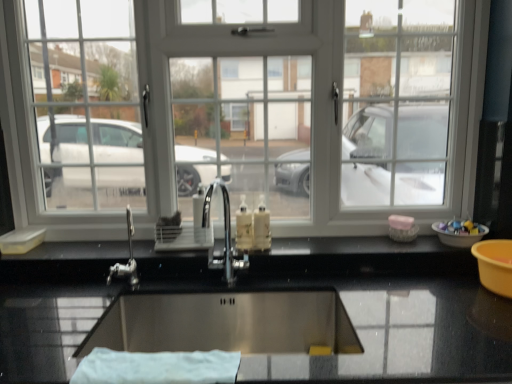
Identify the location of white cloth at lower center. click(x=157, y=367).

What do you see at coordinates (244, 110) in the screenshot? I see `white plastic window at center` at bounding box center [244, 110].

Find the location of a particular element. stainless steel sink at center is located at coordinates (226, 322).

Locate an element on the screen. The height and width of the screenshot is (384, 512). polished chrome tap at center is located at coordinates pyautogui.click(x=225, y=236).

Where is `white cloth at lower center`? Image resolution: width=512 pixels, height=384 pixels. white cloth at lower center is located at coordinates (157, 367).

Does polished chrome tap at center have a greater height compared to stainless steel sink at center?

Correct, polished chrome tap at center is much taller as stainless steel sink at center.

Is polished chrome tap at center inside or outside of stainless steel sink at center?

polished chrome tap at center lies outside stainless steel sink at center.

Is point (229, 250) less distant than point (346, 326)?

No, (229, 250) is further to viewer.

Considering the positions of objects polished chrome tap at center and stainless steel sink at center in the image provided, who is behind, polished chrome tap at center or stainless steel sink at center?

polished chrome tap at center is behind.

From a real-world perspective, who is located lower, white plastic window at center or translucent plastic soap dispenser at center?

translucent plastic soap dispenser at center.

In the image, there is a white plastic window at center. At what (x,y) coordinates should I click in order to perform the action: click on soap dispenser below it (from a real-world perspective). Please return your answer as a coordinate pair (x, y). Looking at the image, I should click on (244, 227).

Which object is further away from the camera taking this photo, white plastic window at center or translucent plastic soap dispenser at center?

white plastic window at center is further from the camera.

You are a GUI agent. You are given a task and a screenshot of the screen. Output one action in this format:
    pyautogui.click(x=<x>, y=<y>)
    Task: Click on the bath towel that appears in front of the white plastic bowl at right
    
    Given the screenshot: What is the action you would take?
    pyautogui.click(x=157, y=367)

Is white plastic bowl at right thinner than white cloth at lower center?

In fact, white plastic bowl at right might be wider than white cloth at lower center.

From a real-world perspective, is white plastic bowl at right beneath white cloth at lower center?

Incorrect, from a real-world perspective, white plastic bowl at right is higher than white cloth at lower center.

Considering the relative sizes of polished chrome tap at center and white plastic bowl at right in the image provided, is polished chrome tap at center bigger than white plastic bowl at right?

Yes, polished chrome tap at center is bigger than white plastic bowl at right.

In the image, there is a white plastic bowl at right. Where is `tap below it (from the image's perspective)`? The image size is (512, 384). tap below it (from the image's perspective) is located at coordinates (225, 236).

Does polished chrome tap at center lie in front of white plastic bowl at right?

Yes, polished chrome tap at center is closer to the camera.

How many degrees apart are the facing directions of polished chrome tap at center and white plastic bowl at right?

2.19 degrees.

You are a GUI agent. You are given a task and a screenshot of the screen. Output one action in this format:
    pyautogui.click(x=<x>, y=<y>)
    Task: Click on the window behind the stainless steel sink at center
    This screenshot has width=512, height=384.
    Given the screenshot: What is the action you would take?
    pyautogui.click(x=244, y=110)

Who is bigger, stainless steel sink at center or white plastic window at center?

Bigger between the two is stainless steel sink at center.

Is stainless steel sink at center oriented away from white plastic window at center?

stainless steel sink at center is not turned away from white plastic window at center.

In the scene shown: From the image's perspective, which is above, stainless steel sink at center or white plastic window at center?

white plastic window at center is shown above in the image.

At what (x,y) coordinates should I click in order to perform the action: click on wide that appears on the left of stainless steel sink at center. Please return your answer as a coordinate pair (x, y). This screenshot has height=384, width=512. Looking at the image, I should click on (226, 322).

Which of these two, stainless steel sink at center or stainless steel sink at center, stands taller?

Standing taller between the two is stainless steel sink at center.

Is stainless steel sink at center positioned with its back to stainless steel sink at center?

Yes, stainless steel sink at center's orientation is away from stainless steel sink at center.

From a real-world perspective, is stainless steel sink at center positioned above or below stainless steel sink at center?

stainless steel sink at center is situated higher than stainless steel sink at center in the real world.

The height and width of the screenshot is (384, 512). What are the coordinates of `countertop below the white plastic window at center (from a real-world perspective)` in the screenshot? It's located at (401, 304).

In terms of height, does white plastic window at center look taller or shorter compared to stainless steel sink at center?

white plastic window at center is taller than stainless steel sink at center.

Would you say white plastic window at center is inside or outside stainless steel sink at center?

white plastic window at center exists outside the volume of stainless steel sink at center.

Between white plastic window at center and stainless steel sink at center, which one has smaller size?

With smaller size is white plastic window at center.

Image resolution: width=512 pixels, height=384 pixels. Identify the location of wide that is below the polished chrome tap at center (from the image's perspective). (226, 322).

Find the location of a particular element. This screenshot has height=384, width=512. window above the translucent plastic soap dispenser at center (from the image's perspective) is located at coordinates (244, 110).

Based on their spatial positions, is white cloth at lower center or stainless steel sink at center further from translucent plastic soap dispenser at center?

white cloth at lower center.

When comparing their distances from white cloth at lower center, does stainless steel sink at center or white plastic bowl at right seem closer?

stainless steel sink at center is closer to white cloth at lower center.

From the image, which object appears to be farther from white plastic window at center, polished chrome tap at center or stainless steel sink at center?

stainless steel sink at center is positioned further to the anchor white plastic window at center.

When comparing their distances from polished chrome tap at center, does translucent plastic soap dispenser at center or stainless steel sink at center seem closer?

The object closer to polished chrome tap at center is translucent plastic soap dispenser at center.

Based on their spatial positions, is stainless steel sink at center or stainless steel sink at center closer to polished chrome tap at center?

stainless steel sink at center lies closer to polished chrome tap at center than the other object.

When comparing their distances from white plastic window at center, does polished chrome tap at center or stainless steel sink at center seem further?

Based on the image, polished chrome tap at center appears to be further to white plastic window at center.

Consider the image. Estimate the real-world distances between objects in this image. Which object is closer to white cloth at lower center, polished chrome tap at center or stainless steel sink at center?

The object closer to white cloth at lower center is stainless steel sink at center.

In the scene shown: Estimate the real-world distances between objects in this image. Which object is further from white cloth at lower center, polished chrome tap at center or translucent plastic soap dispenser at center?

Among the two, translucent plastic soap dispenser at center is located further to white cloth at lower center.

Find the location of a particular element. The image size is (512, 384). tap between white plastic window at center and stainless steel sink at center in the up-down direction is located at coordinates (225, 236).

The height and width of the screenshot is (384, 512). I want to click on countertop situated between white cloth at lower center and white plastic bowl at right from left to right, so click(x=401, y=304).

The height and width of the screenshot is (384, 512). In order to click on bath towel between stainless steel sink at center and stainless steel sink at center in the front-back direction in this screenshot , I will do `click(157, 367)`.

Find the location of `window situated between stainless steel sink at center and white plastic bowl at right from left to right`. window situated between stainless steel sink at center and white plastic bowl at right from left to right is located at coordinates (244, 110).